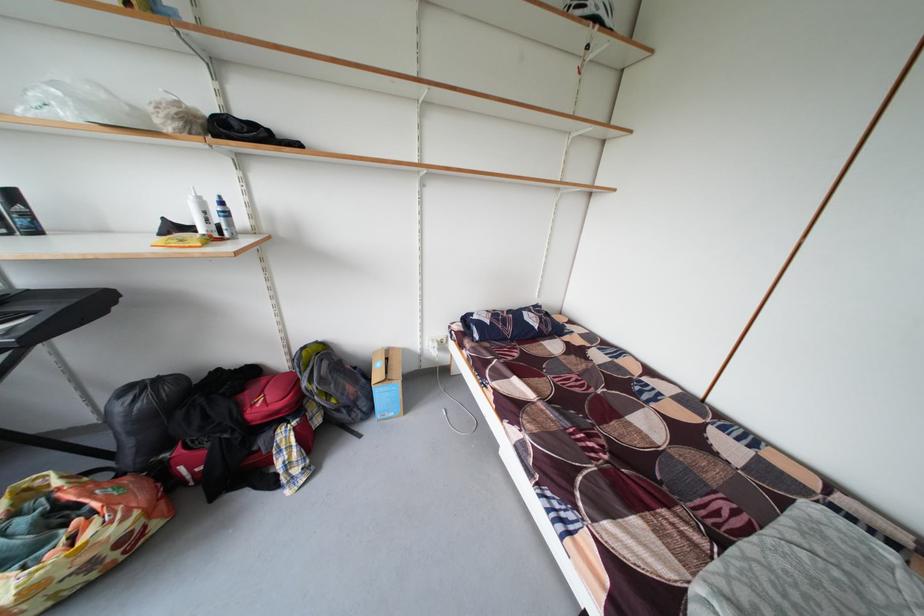
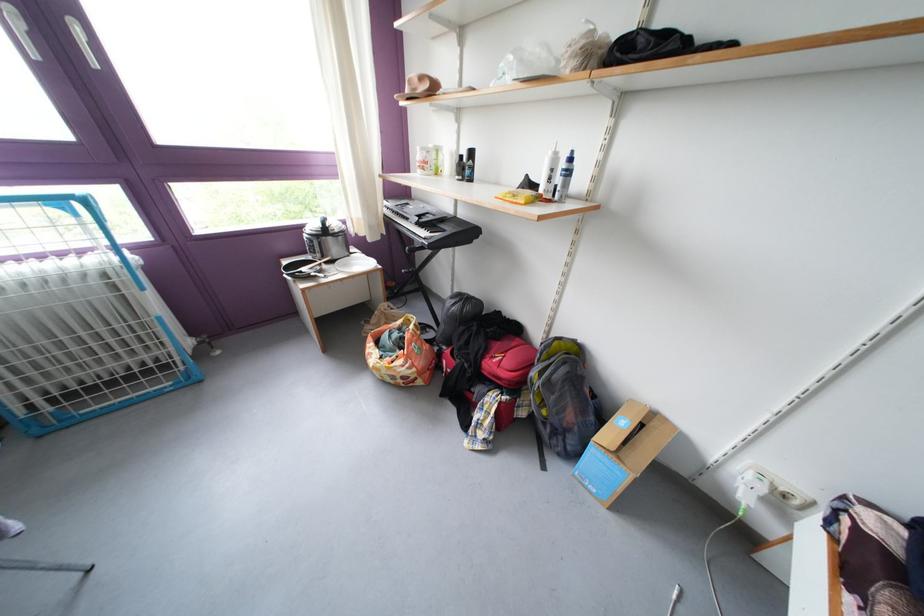
Find the pixel in the second image that matches (x=436, y=344) in the first image.

(758, 467)